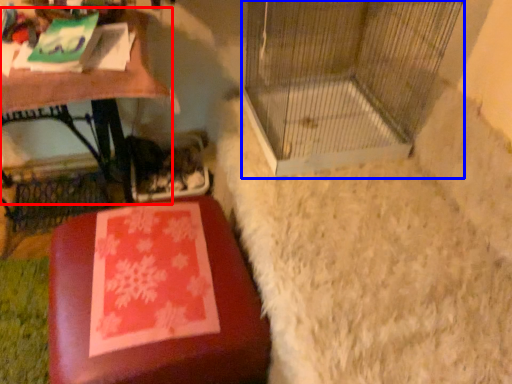
Question: Which object is further to the camera taking this photo, table (highlighted by a red box) or bird cage (highlighted by a blue box)?

Choices:
 (A) table
 (B) bird cage

Answer: (A)